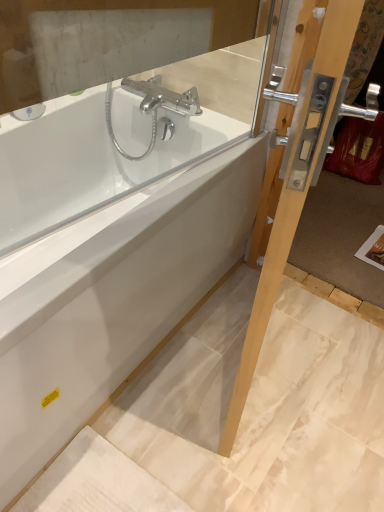
This screenshot has height=512, width=384. I want to click on unoccupied region to the right of clear glass screen door at right, so click(x=324, y=362).